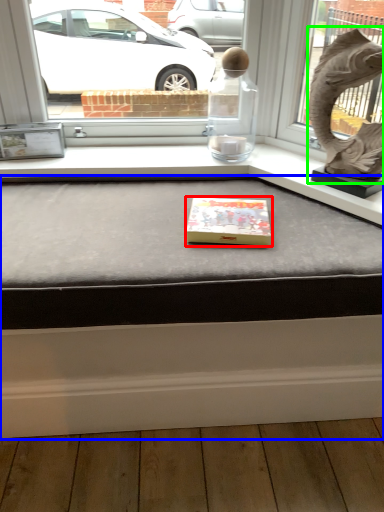
Question: Which object is the farthest from box (highlighted by a red box)? Choose among these: table (highlighted by a blue box) or animal sculpture (highlighted by a green box).

Choices:
 (A) table
 (B) animal sculpture

Answer: (B)